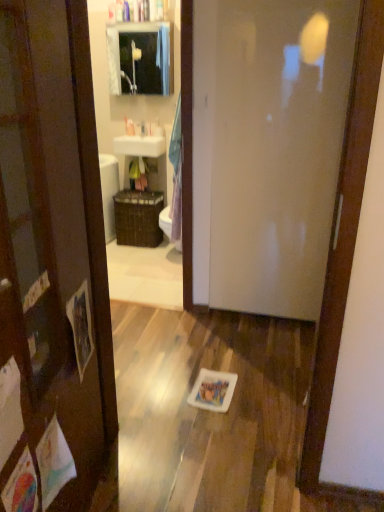
Question: From the image's perspective, relative to matte glass mirror at upper center, is white plastic cup at upper center, the 1th toiletry when ordered from right to left, above or below?

Choices:
 (A) above
 (B) below

Answer: (B)

Question: Is white plastic cup at upper center, the 1th toiletry when ordered from right to left, situated inside matte glass mirror at upper center or outside?

Choices:
 (A) inside
 (B) outside

Answer: (B)

Question: Estimate the real-world distances between objects in this image. Which object is farther from the white glossy toilet at center?

Choices:
 (A) white glossy sink at upper center
 (B) white plastic cup at upper center, the 1th toiletry when ordered from right to left
 (C) brown woven basket at center
 (D) matte glass mirror at upper center
 (E) white glossy door at center

Answer: (D)

Question: Which object is positioned farthest from the white plastic cup at upper center, acting as the second toiletry starting from the left?

Choices:
 (A) brown woven basket at center
 (B) white glossy sink at upper center
 (C) white glossy door at center
 (D) white glossy toilet at center
 (E) white plastic soap dispenser at upper center, the 2th toiletry when ordered from right to left

Answer: (C)